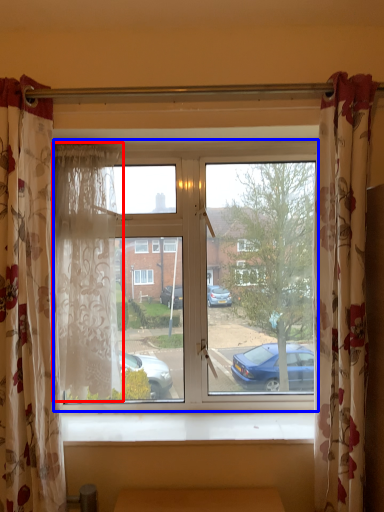
Question: Which point is closer to the camera, curtain (highlighted by a red box) or window (highlighted by a blue box)?

Choices:
 (A) curtain
 (B) window

Answer: (A)